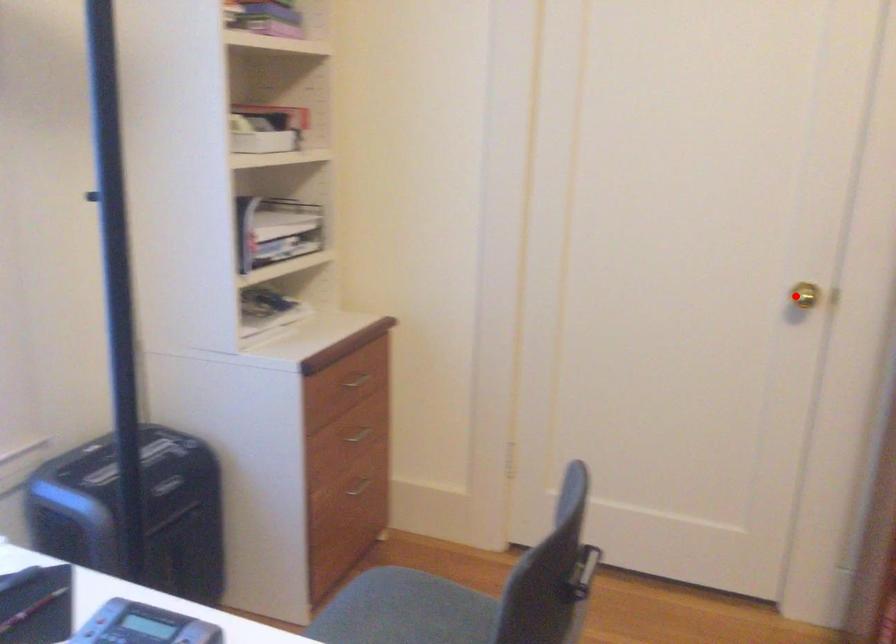
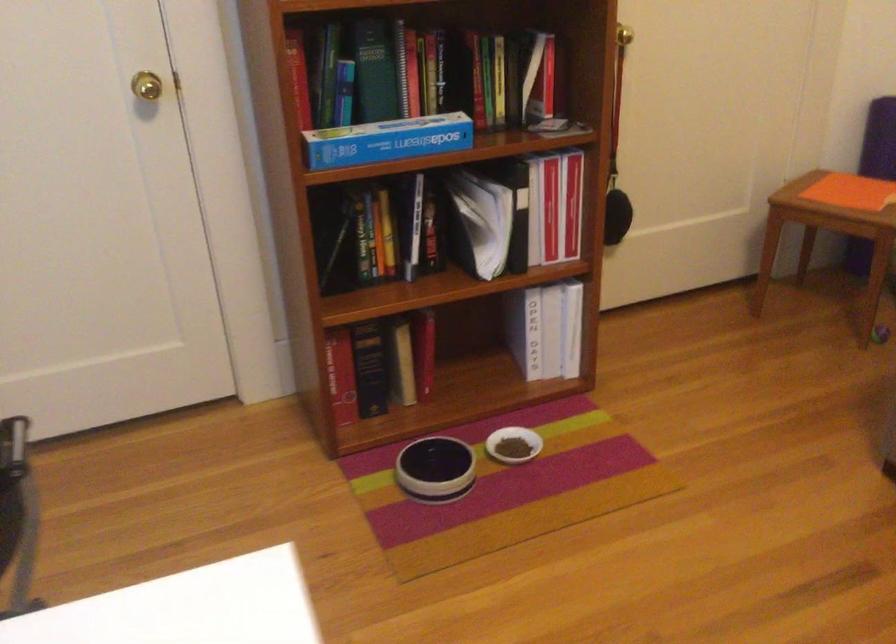
Find the pixel in the second image that matches the highlighted location in the first image.

(147, 86)